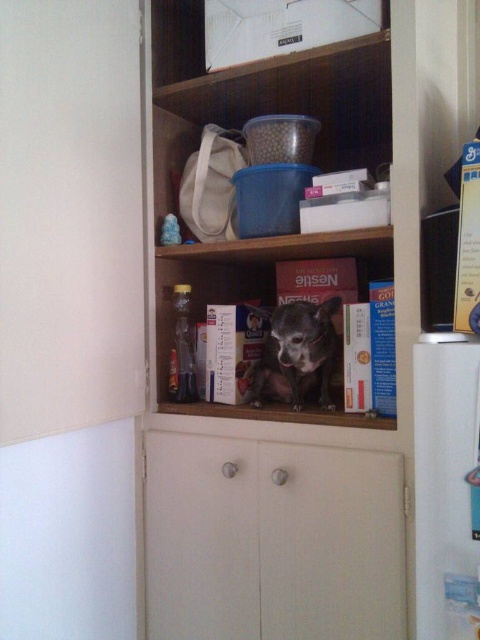
Is point (358, 477) less distant than point (159, 337)?

Yes, it is in front of point (159, 337).

Between white matte cabinet at lower center and wooden shelf at center, which one has less height?

wooden shelf at center is shorter.

Does point (240, 461) come behind point (232, 289)?

No, it is not.

I want to click on white matte cabinet at lower center, so click(273, 540).

Is wooden bookshelf at upper center below white glossy refrigerator at right?

Actually, wooden bookshelf at upper center is above white glossy refrigerator at right.

Does point (166, 134) lie in front of point (445, 637)?

No, it is not.

Image resolution: width=480 pixels, height=640 pixels. What are the coordinates of `wooden bookshelf at upper center` in the screenshot? It's located at (313, 408).

Between point (177, 634) and point (251, 387), which one is positioned behind?

The point (251, 387) is behind.

Looking at this image, does wooden bookshelf at upper center appear under fuzzy brown dog at center?

Actually, wooden bookshelf at upper center is above fuzzy brown dog at center.

Is point (404, 22) closer to camera compared to point (324, 371)?

Yes, point (404, 22) is closer to viewer.

This screenshot has height=640, width=480. Find the location of `wooden bookshelf at upper center`. wooden bookshelf at upper center is located at coordinates (313, 408).